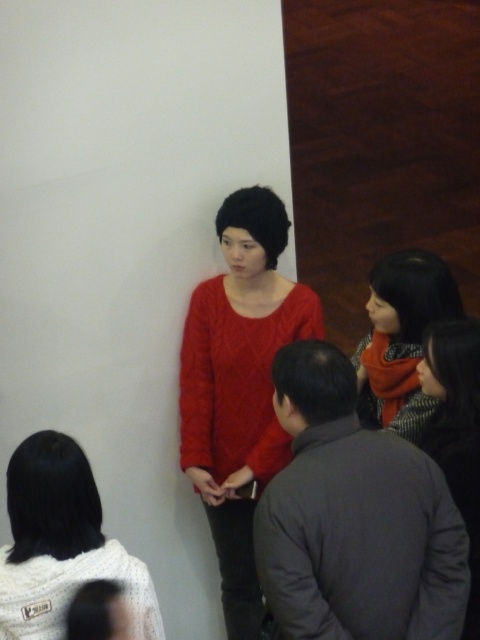
What is the position of the point at coordinates [240,385] in the image?

The point at coordinates [240,385] is located on the cable knit sweater at center.